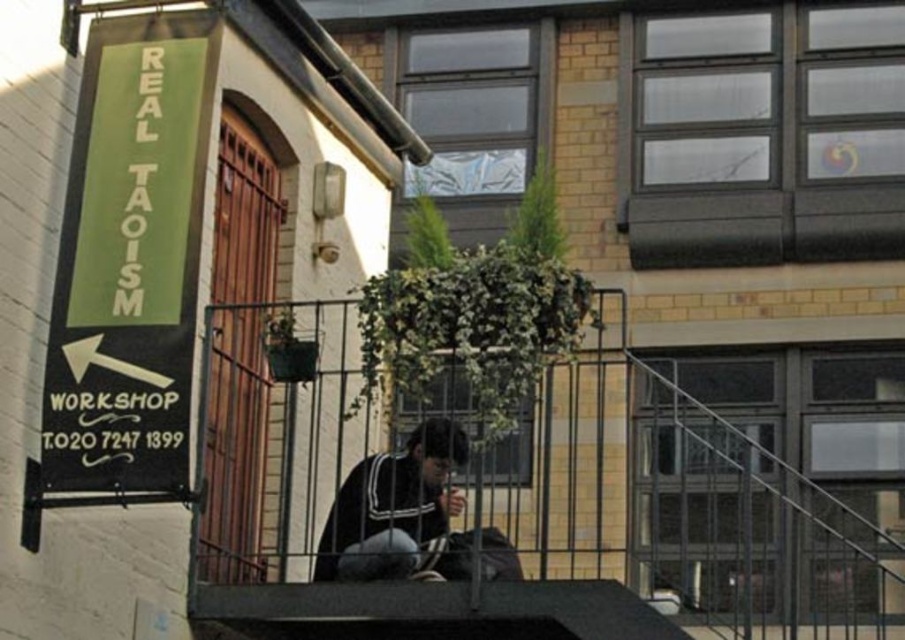
You are a delivery person trying to locate the entrance to the building. You see the metallic gray balcony at center and the green matte sign at upper left. Which object is positioned higher up in the image?

The green matte sign at upper left is positioned higher up in the image than the metallic gray balcony at center.

You are standing in front of the building and want to reach the door with wooden finish and metal bars. There is a metallic gray balcony at center and a dark blue fabric jacket at center in your way. Which object should you move around to get to the door?

The metallic gray balcony at center is closer to the viewer than the dark blue fabric jacket at center, so you should move around the metallic gray balcony at center first to reach the door.

You are a delivery person trying to locate the entrance to the building. You see the metallic gray balcony at center and the green matte sign at upper left. Which object is bigger in size?

The metallic gray balcony at center has a larger size compared to the green matte sign at upper left, so the metallic gray balcony at center is bigger in size.